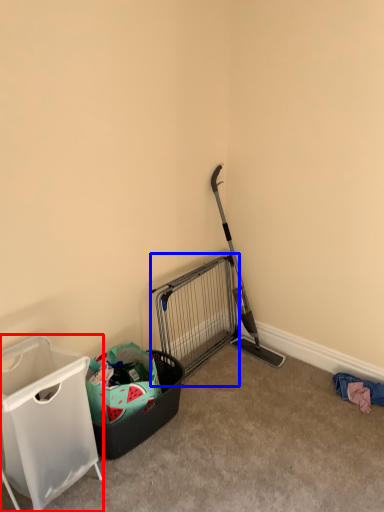
Question: Which of the following is the farthest to the observer, waste container (highlighted by a red box) or cage (highlighted by a blue box)?

Choices:
 (A) waste container
 (B) cage

Answer: (B)